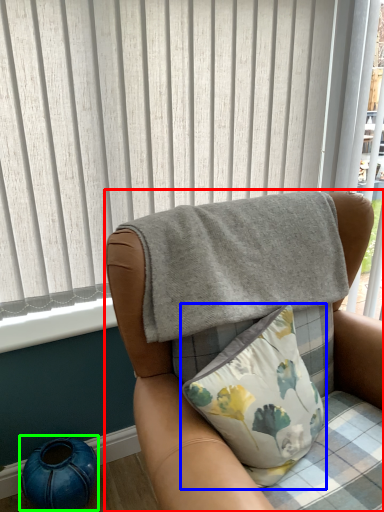
Question: Which is farther away from chair (highlighted by a red box)? pillow (highlighted by a blue box) or teal (highlighted by a green box)?

Choices:
 (A) pillow
 (B) teal

Answer: (B)